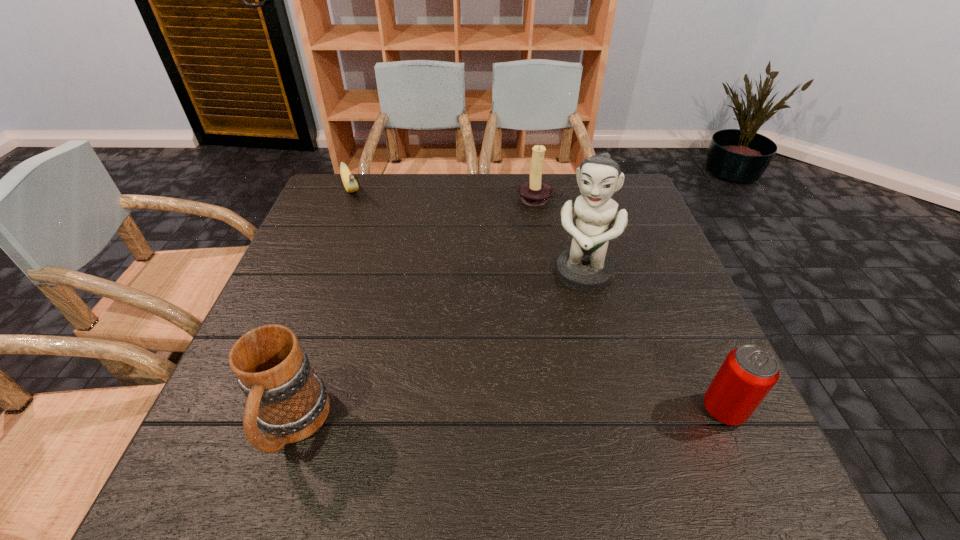
I want to click on free space on the desktop that is between the mug and the fourth tallest object and is positioned on the wick of the candle holder, so click(x=475, y=419).

The width and height of the screenshot is (960, 540). Find the location of `vacant space on the desktop that is between the mug and the rightmost object and is positioned on the front-facing side of the figurine`. vacant space on the desktop that is between the mug and the rightmost object and is positioned on the front-facing side of the figurine is located at coordinates [528, 417].

At what (x,y) coordinates should I click in order to perform the action: click on free spot on the desktop that is between the mug and the can and is positioned at the stem of the shortest object. Please return your answer as a coordinate pair (x, y). The height and width of the screenshot is (540, 960). Looking at the image, I should click on (453, 420).